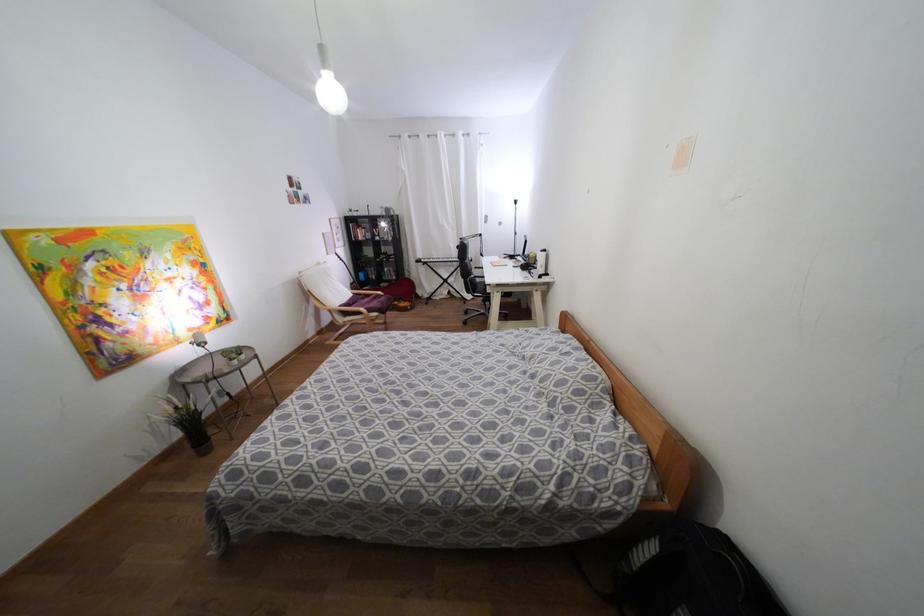
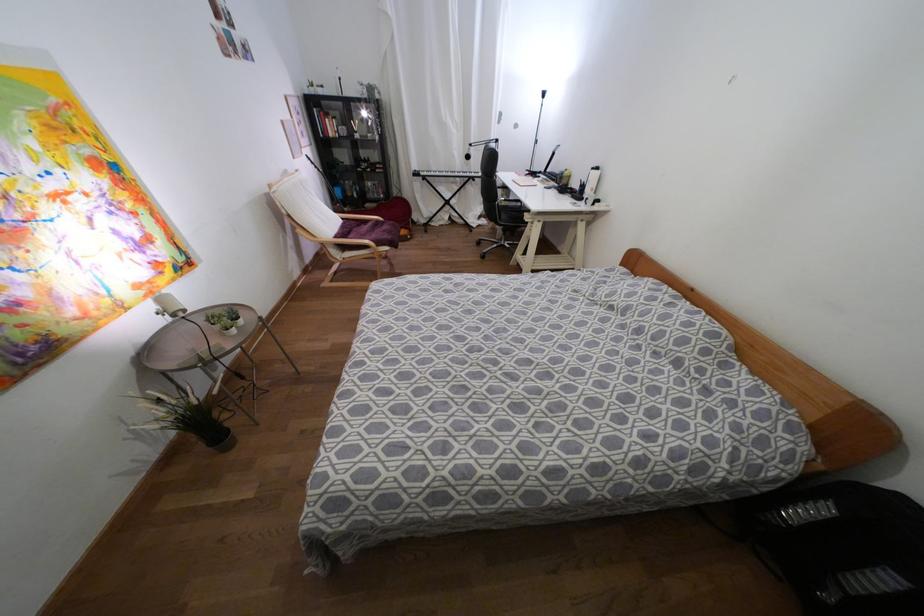
The images are taken continuously from a first-person perspective. In which direction are you moving?

The cameraman walked toward left, forward.